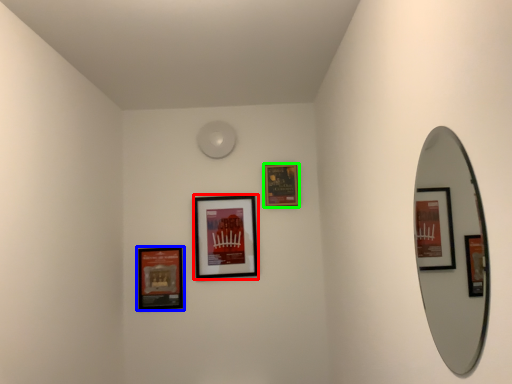
Question: Which object is positioned closest to picture frame (highlighted by a red box)? Select from picture frame (highlighted by a blue box) and picture frame (highlighted by a green box).

Choices:
 (A) picture frame
 (B) picture frame

Answer: (A)